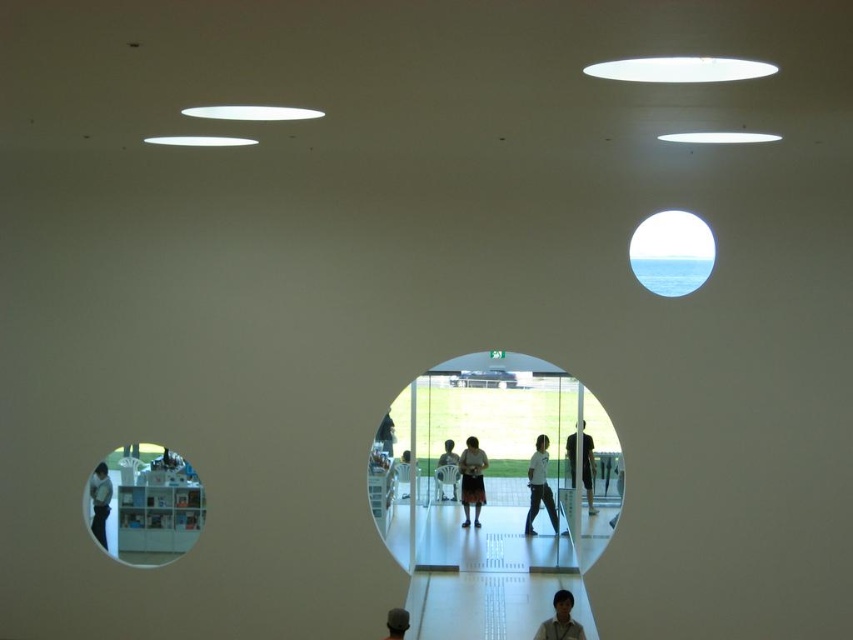
In the scene shown: Is transparent glass hole at upper center wider than light brown hair at lower center?

Yes, transparent glass hole at upper center is wider than light brown hair at lower center.

Between transparent glass hole at upper center and light brown hair at lower center, which one appears on the right side from the viewer's perspective?

From the viewer's perspective, transparent glass hole at upper center appears more on the right side.

Which is in front, point (657, 257) or point (552, 620)?

Point (552, 620) is in front.

Locate an element on the screen. This screenshot has width=853, height=640. transparent glass hole at upper center is located at coordinates (671, 252).

Can you confirm if transparent glass hole at upper center is wider than dark gray fabric shirt at center?

Indeed, transparent glass hole at upper center has a greater width compared to dark gray fabric shirt at center.

Between point (680, 288) and point (585, 438), which one is positioned in front?

Point (680, 288)

Locate an element on the screen. This screenshot has width=853, height=640. transparent glass hole at upper center is located at coordinates (671, 252).

Is matte gray skirt at center bigger than dark gray fabric shirt at center?

Indeed, matte gray skirt at center has a larger size compared to dark gray fabric shirt at center.

Is matte gray skirt at center below dark gray fabric shirt at center?

Indeed, matte gray skirt at center is positioned under dark gray fabric shirt at center.

Where is `matte gray skirt at center`? matte gray skirt at center is located at coordinates (473, 480).